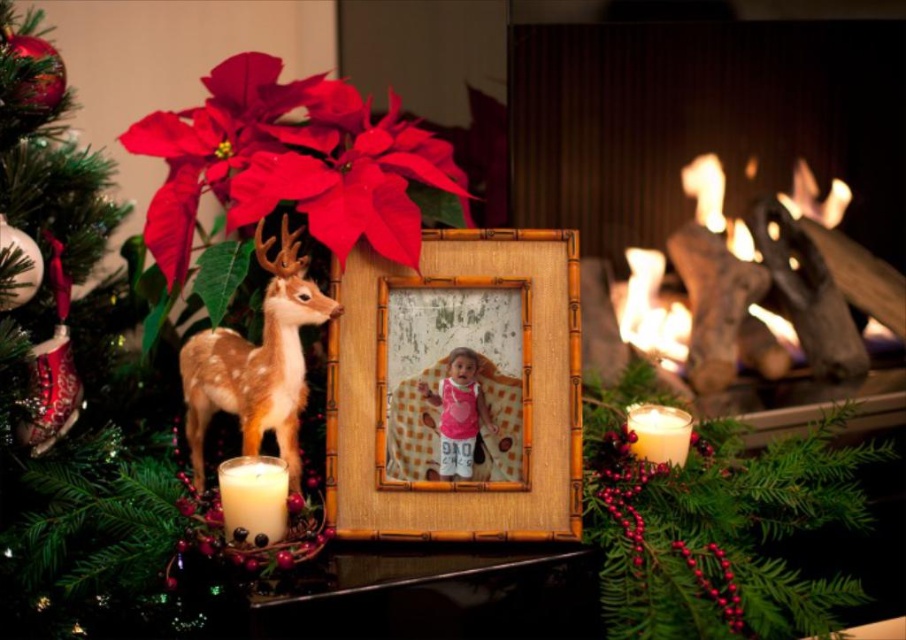
You are a guest at this holiday gathering and want to place a small ornament between the translucent glass candle at lower right and the frosted glass deer at center. Which object should you place it closer to if you want the ornament to be closer to the smaller object?

The frosted glass deer at center is smaller than the translucent glass candle at lower right, so you should place the ornament closer to the frosted glass deer at center to be nearer to the smaller object.

You are an interior designer planning to hang a picture frame exactly at the center of the wall. The current arrangement has a bright red matte poinsettia at upper center. Where should you place the new frame so it is centered relative to the poinsettia?

The bright red matte poinsettia at upper center is located at coordinates (290, 163). To center the new frame relative to it, place the frame at the same coordinates, ensuring symmetry and alignment with the existing decor.

You are arranging a holiday display and want to place a small gift box between the bright red matte poinsettia at upper center and the frosted glass deer at center. Based on their positions, which object should the gift box be closer to?

The bright red matte poinsettia at upper center is positioned on the right side of the frosted glass deer at center, so the gift box should be placed closer to the frosted glass deer at center to be between them.